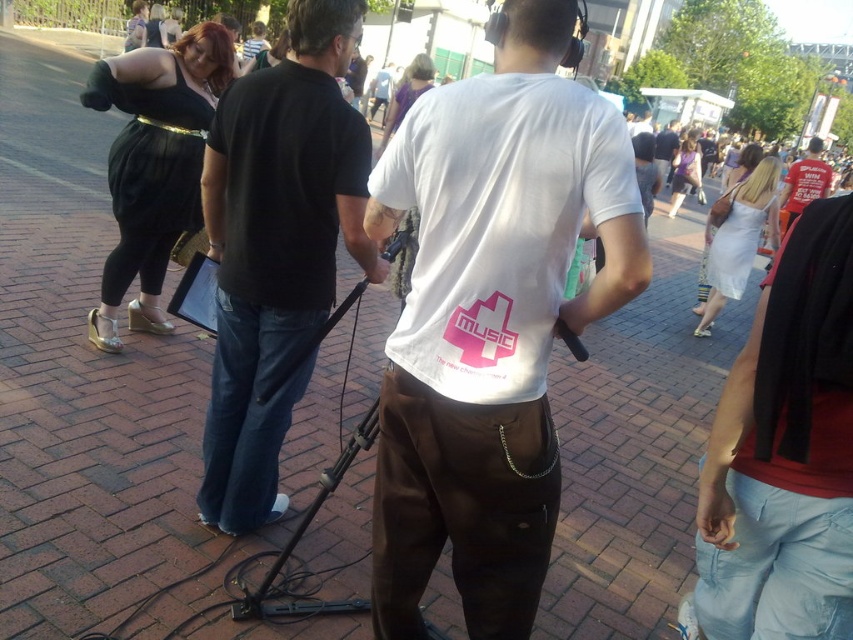
Question: Is white matte t-shirt at center bigger than matte purple dress at center?

Choices:
 (A) no
 (B) yes

Answer: (A)

Question: Can you confirm if black cotton t-shirt at center is positioned to the left of white cotton t-shirt at center?

Choices:
 (A) yes
 (B) no

Answer: (A)

Question: Which point appears closest to the camera in this image?

Choices:
 (A) (349, 243)
 (B) (413, 61)

Answer: (A)

Question: Which point is closer to the camera?

Choices:
 (A) purple fabric at upper center
 (B) white cotton t-shirt at center

Answer: (A)

Question: Where is black cotton t-shirt at center located in relation to red matte shirt at upper right in the image?

Choices:
 (A) above
 (B) below

Answer: (B)

Question: Which point is farther to the camera?

Choices:
 (A) white matte t-shirt at center
 (B) purple fabric at upper center

Answer: (B)